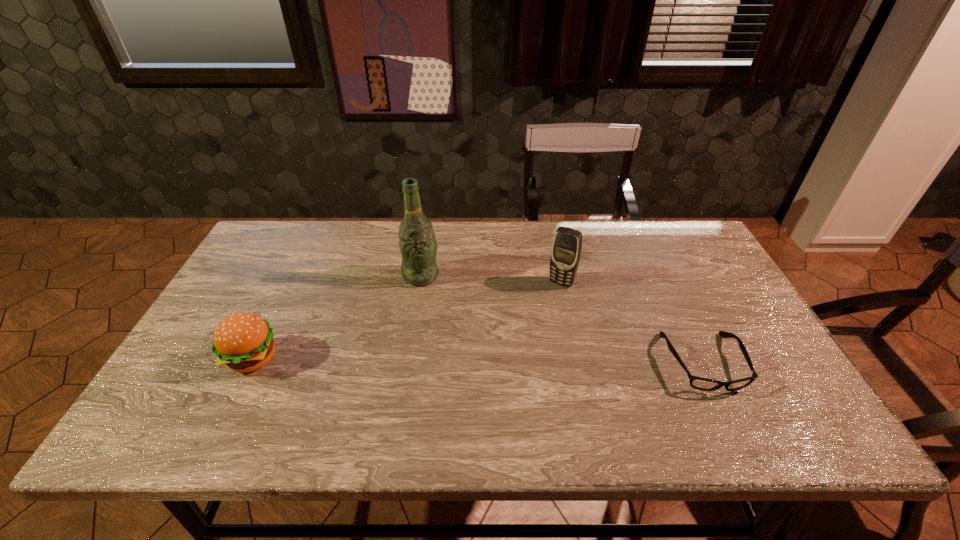
This screenshot has height=540, width=960. What are the coordinates of `free spot on the desktop that is between the leftmost object and the spectacles and is positioned on the surface of the tallest object` in the screenshot? It's located at (495, 361).

You are a GUI agent. You are given a task and a screenshot of the screen. Output one action in this format:
    pyautogui.click(x=<x>, y=<y>)
    Task: Click on the free space on the desktop that is between the third tallest object and the spectacles and is positioned on the front face of the third object from left to right
    This screenshot has height=540, width=960.
    Given the screenshot: What is the action you would take?
    pyautogui.click(x=516, y=361)